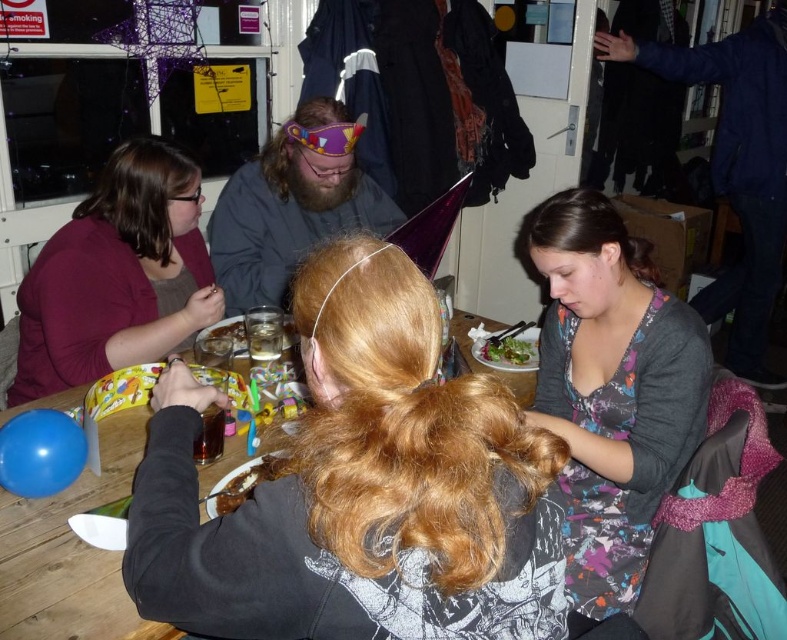
Question: Is dark blue jacket at upper right smaller than green leafy salad at center?

Choices:
 (A) no
 (B) yes

Answer: (A)

Question: Which is farther from the floral dress at lower right?

Choices:
 (A) matte purple sweater at upper left
 (B) dark gray hoodie at center

Answer: (A)

Question: Among these objects, which one is farthest from the camera?

Choices:
 (A) matte purple headband at center
 (B) chocolate cake at center
 (C) dark blue jacket at upper right
 (D) green leafy salad at center

Answer: (C)

Question: Can you confirm if dark gray hoodie at center is positioned to the right of matte purple sweater at upper left?

Choices:
 (A) no
 (B) yes

Answer: (B)

Question: Considering the real-world distances, which object is farthest from the matte purple sweater at upper left?

Choices:
 (A) matte purple headband at center
 (B) floral dress at lower right
 (C) green leafy salad at center
 (D) dark blue jacket at upper right

Answer: (D)

Question: Is floral dress at lower right closer to camera compared to green leafy salad at center?

Choices:
 (A) no
 (B) yes

Answer: (B)